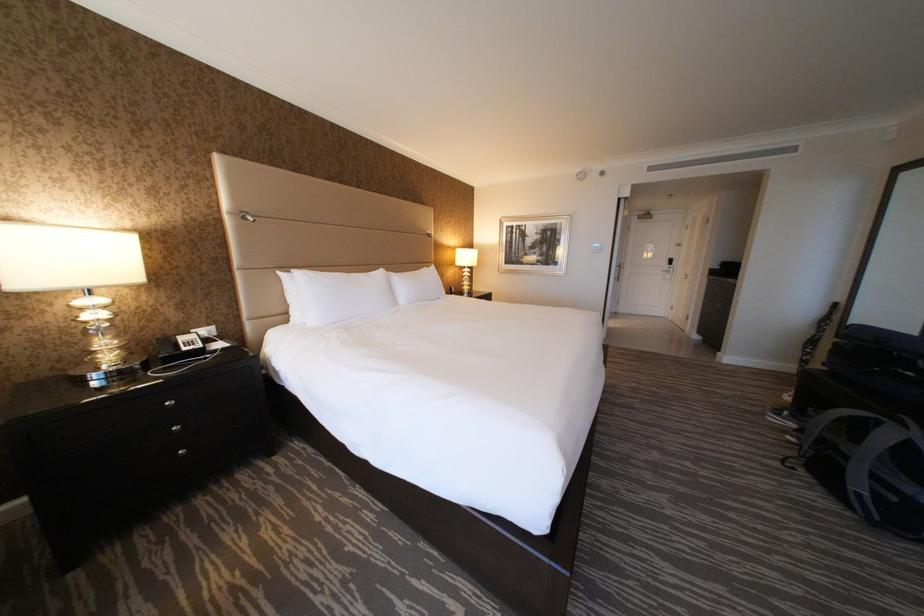
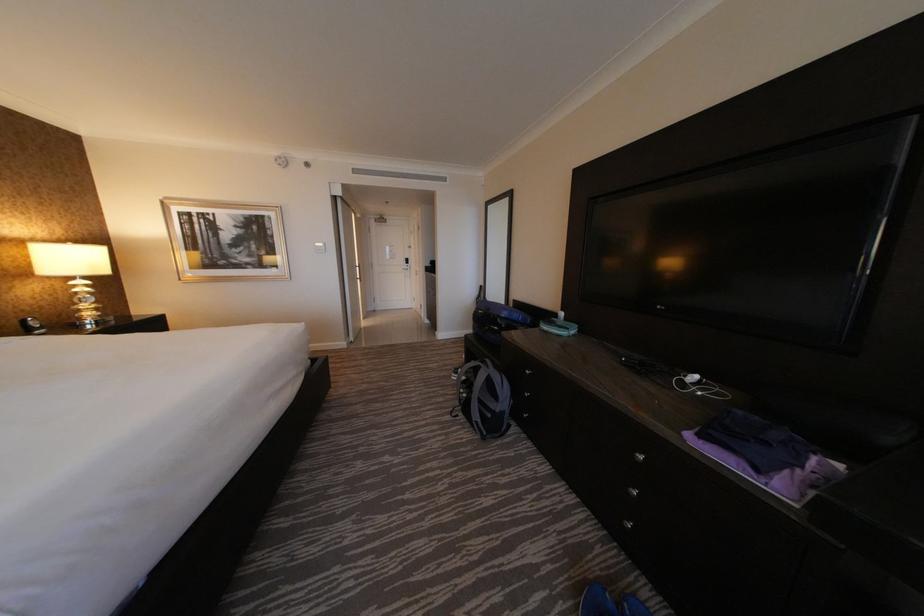
Question: The camera is either moving clockwise (left) or counter-clockwise (right) around the object. The first image is from the beginning of the video and the second image is from the end. Is the camera moving left or right when shooting the video?

Choices:
 (A) Left
 (B) Right

Answer: (A)